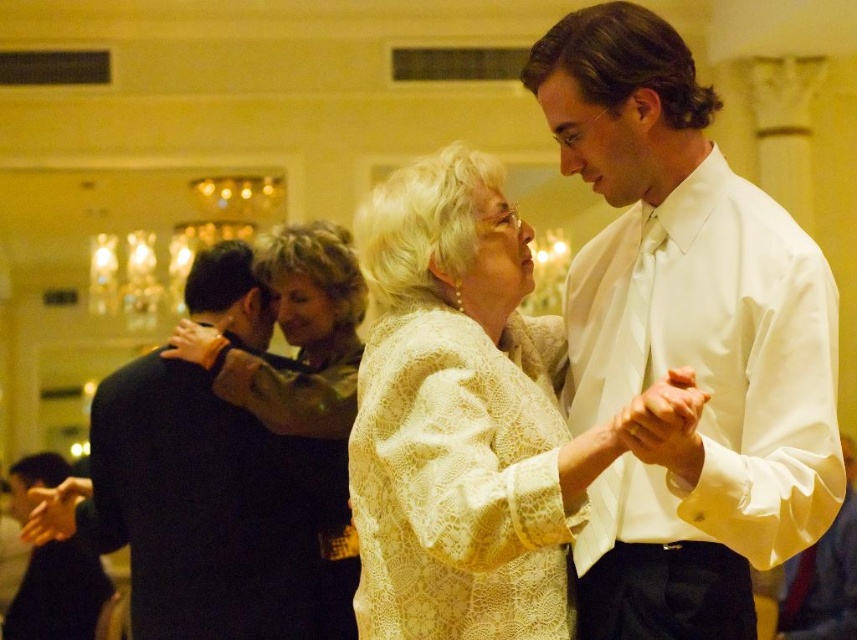
Question: Which point is closer to the camera taking this photo?

Choices:
 (A) (202, 620)
 (B) (588, 387)
 (C) (580, 445)

Answer: (C)

Question: Is dark brown wool robe at left bigger than black matte suit at lower left?

Choices:
 (A) no
 (B) yes

Answer: (A)

Question: Can you confirm if lace fabric dress at center is positioned above dark brown wool robe at left?

Choices:
 (A) no
 (B) yes

Answer: (B)

Question: Is lacy beige dress at center thinner than black matte suit at lower left?

Choices:
 (A) yes
 (B) no

Answer: (A)

Question: Estimate the real-world distances between objects in this image. Which object is farther from the black matte suit at lower left?

Choices:
 (A) white satin shirt at center
 (B) light brown lace blouse at center

Answer: (A)

Question: Which of the following is the closest to the observer?

Choices:
 (A) (794, 227)
 (B) (43, 468)
 (C) (247, 515)
 (D) (327, 288)

Answer: (A)